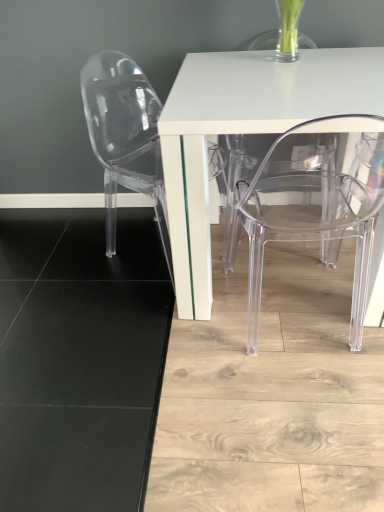
Question: Is white glossy table at center turned away from transparent plastic chair at left, the first chair from the left?

Choices:
 (A) yes
 (B) no

Answer: (B)

Question: Could you tell me if white glossy table at center is facing transparent plastic chair at left, the first chair from the left?

Choices:
 (A) no
 (B) yes

Answer: (A)

Question: Would you say white glossy table at center is a long distance from transparent plastic chair at left, the first chair from the left?

Choices:
 (A) yes
 (B) no

Answer: (B)

Question: From a real-world perspective, is white glossy table at center physically above transparent plastic chair at left, arranged as the second chair when viewed from the right?

Choices:
 (A) no
 (B) yes

Answer: (A)

Question: Does white glossy table at center contain transparent plastic chair at left, the first chair from the left?

Choices:
 (A) yes
 (B) no

Answer: (B)

Question: Is white glossy table at center at the left side of transparent plastic chair at left, arranged as the second chair when viewed from the right?

Choices:
 (A) yes
 (B) no

Answer: (B)

Question: Is white glossy table at center located outside transparent acrylic chair at lower right, which is the 2th chair in left-to-right order?

Choices:
 (A) yes
 (B) no

Answer: (A)

Question: Considering the relative sizes of white glossy table at center and transparent acrylic chair at lower right, the first chair when ordered from right to left, in the image provided, is white glossy table at center taller than transparent acrylic chair at lower right, the first chair when ordered from right to left,?

Choices:
 (A) no
 (B) yes

Answer: (A)

Question: Is white glossy table at center surrounding transparent acrylic chair at lower right, the first chair when ordered from right to left?

Choices:
 (A) no
 (B) yes

Answer: (B)

Question: Considering the relative positions of white glossy table at center and transparent acrylic chair at lower right, which is the 2th chair in left-to-right order, in the image provided, is white glossy table at center to the left of transparent acrylic chair at lower right, which is the 2th chair in left-to-right order, from the viewer's perspective?

Choices:
 (A) no
 (B) yes

Answer: (A)

Question: Does white glossy table at center have a greater width compared to transparent acrylic chair at lower right, the first chair when ordered from right to left?

Choices:
 (A) yes
 (B) no

Answer: (A)

Question: Would you consider white glossy table at center to be distant from transparent acrylic chair at lower right, which is the 2th chair in left-to-right order?

Choices:
 (A) yes
 (B) no

Answer: (B)

Question: Is transparent acrylic chair at lower right, the first chair when ordered from right to left, not inside transparent plastic chair at left, arranged as the second chair when viewed from the right?

Choices:
 (A) no
 (B) yes

Answer: (B)